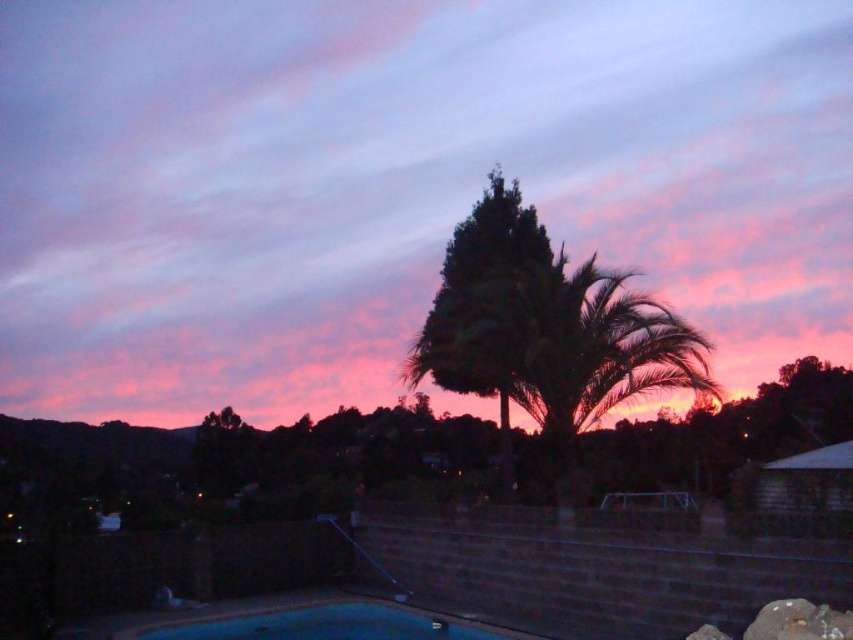
Question: Which point is closer to the camera?

Choices:
 (A) silhouette leafy palm at center
 (B) pink cotton candy cloud at upper center
 (C) blue smooth pool at lower center

Answer: (C)

Question: Which object is closer to the camera taking this photo?

Choices:
 (A) pink cotton candy cloud at upper center
 (B) silhouette leafy palm at center

Answer: (B)

Question: Which point is farther from the camera taking this photo?

Choices:
 (A) (525, 349)
 (B) (801, 54)
 (C) (306, 634)

Answer: (B)

Question: Is pink cotton candy cloud at upper center bigger than silhouette leafy palm at center?

Choices:
 (A) yes
 (B) no

Answer: (A)

Question: Does silhouette leafy palm at center appear on the left side of blue smooth pool at lower center?

Choices:
 (A) yes
 (B) no

Answer: (B)

Question: Is pink cotton candy cloud at upper center below blue smooth pool at lower center?

Choices:
 (A) no
 (B) yes

Answer: (A)